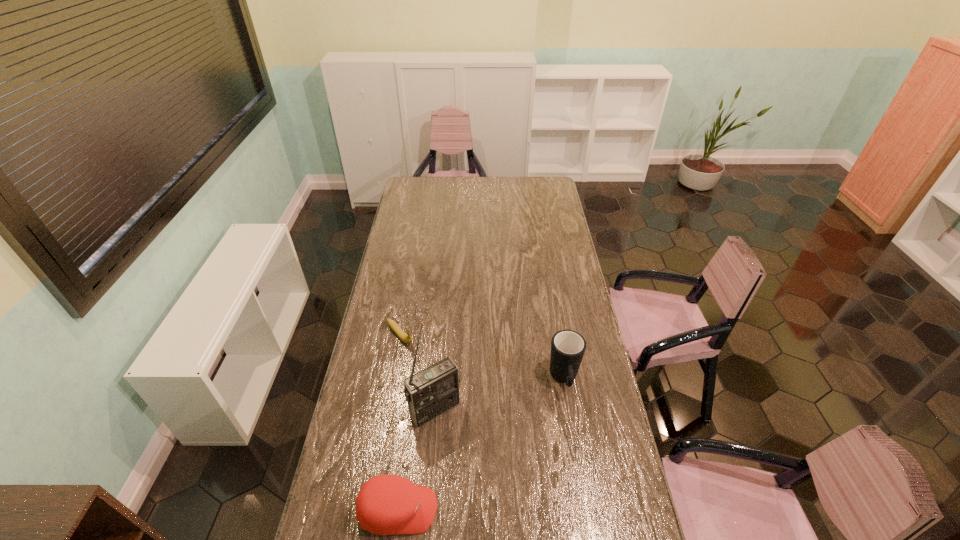
I want to click on free space located at the stem of the banana, so click(x=462, y=403).

The width and height of the screenshot is (960, 540). In order to click on vacant area located at the stem of the banana in this screenshot , I will do [x=446, y=387].

Where is `vacant space located at the stem of the banana`? vacant space located at the stem of the banana is located at coordinates (455, 395).

Find the location of `object that is at the near edge`. object that is at the near edge is located at coordinates (386, 504).

Locate an element on the screen. cap at the left edge is located at coordinates (386, 504).

Identify the location of banana located at the left edge. (407, 339).

In order to click on object that is at the right edge in this screenshot , I will do `click(568, 347)`.

Locate an element on the screen. The image size is (960, 540). object located at the near left corner is located at coordinates (386, 504).

This screenshot has width=960, height=540. I want to click on vacant space at the far edge of the desktop, so click(x=521, y=195).

The width and height of the screenshot is (960, 540). I want to click on blank space at the near edge of the desktop, so click(449, 516).